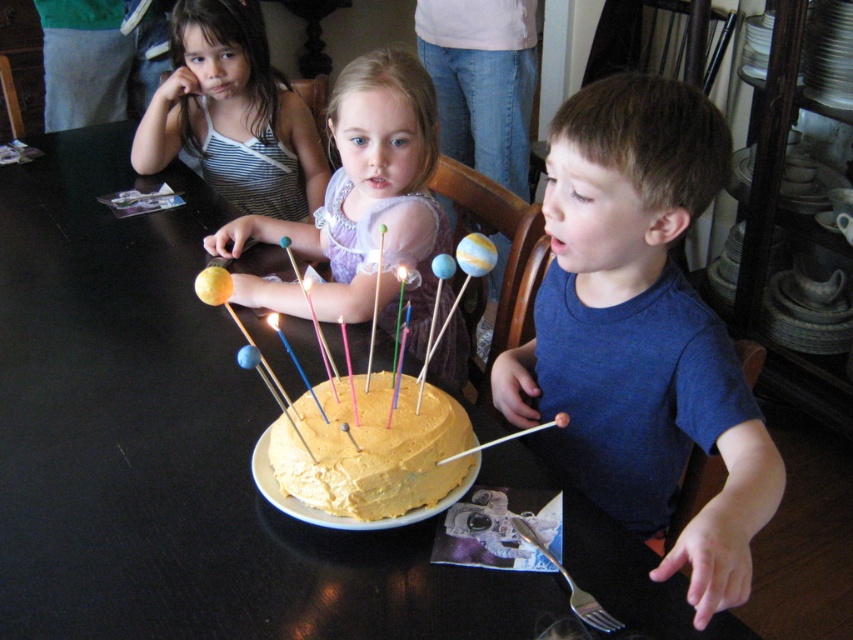
You are a photographer taking pictures of the birthday cake. You notice the black glossy table at center and the matte purple dress at center. Which object should you adjust the camera focus on first if you want to capture both in sharp detail?

The black glossy table at center is much taller than the matte purple dress at center, so you should focus on the black glossy table at center first to ensure both are in sharp detail.

From the picture: You are a photographer standing at the back of the room. You want to take a photo of the black glossy table at center and the matte purple dress at center. The camera you are using has a minimum focus distance of 25 centimeters. Will you be able to focus on both subjects at the same time?

The distance between the black glossy table at center and the matte purple dress at center is 24.08 centimeters, which is less than the camera minimum focus distance of 25 centimeters. Therefore, the camera cannot focus on both subjects simultaneously.